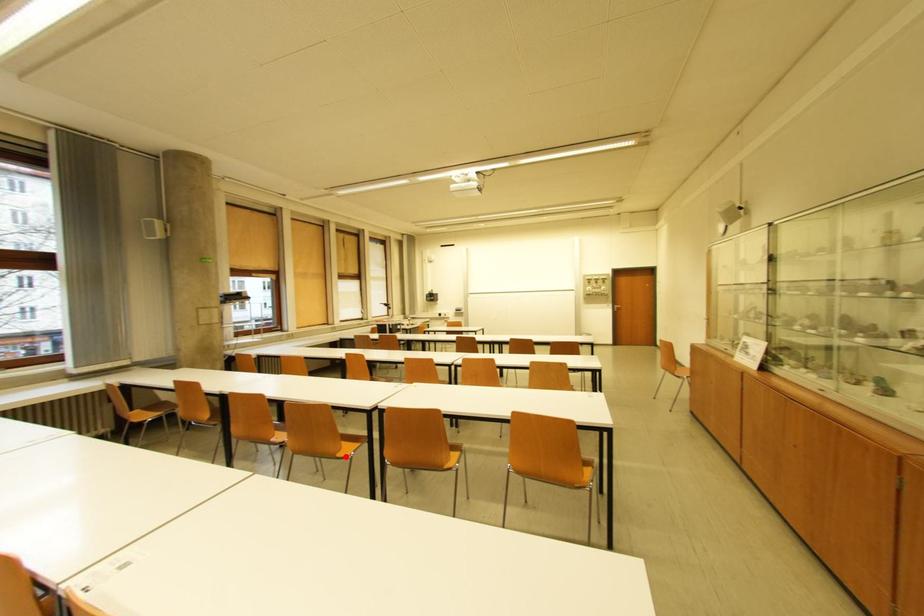
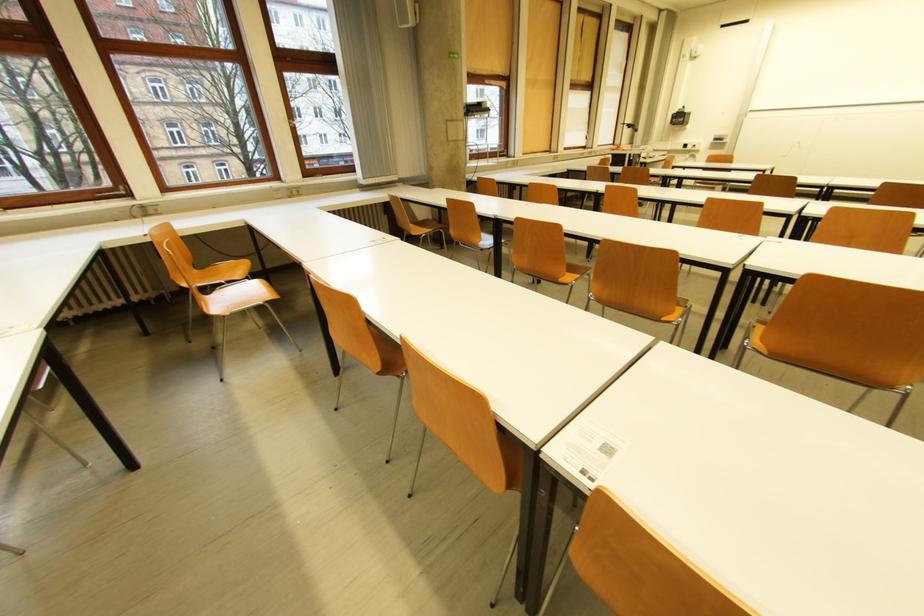
Question: I am providing you with two images of the same scene from different viewpoints. A red point is shown in image1. For the corresponding object point in image2, is it positioned nearer or farther from the camera?

Choices:
 (A) Nearer
 (B) Farther

Answer: (A)